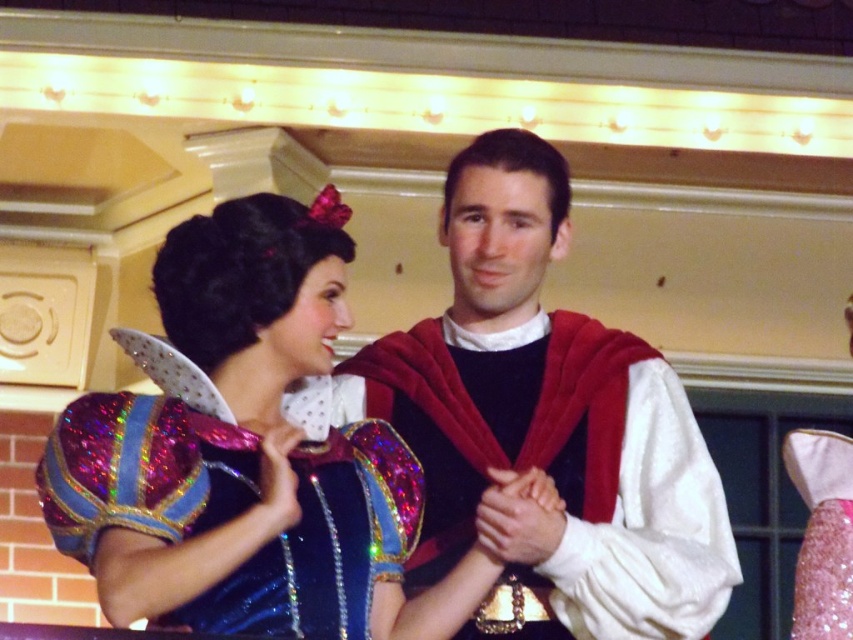
Question: Which object appears closest to the camera in this image?

Choices:
 (A) sparkly blue dress at center
 (B) pink glitter dress at center

Answer: (A)

Question: Can you confirm if velvet red cape at center is positioned above pink glitter dress at center?

Choices:
 (A) yes
 (B) no

Answer: (A)

Question: From the image, what is the correct spatial relationship of sparkly blue dress at center in relation to velvet red cape at center?

Choices:
 (A) above
 (B) below

Answer: (B)

Question: Does velvet red cape at center have a lesser width compared to pink glitter dress at center?

Choices:
 (A) no
 (B) yes

Answer: (A)

Question: Considering the real-world distances, which object is farthest from the sparkly blue dress at center?

Choices:
 (A) pink glitter dress at center
 (B) velvet red cape at center

Answer: (A)

Question: Which is farther from the sparkly blue dress at center?

Choices:
 (A) velvet red cape at center
 (B) pink glitter dress at center

Answer: (B)